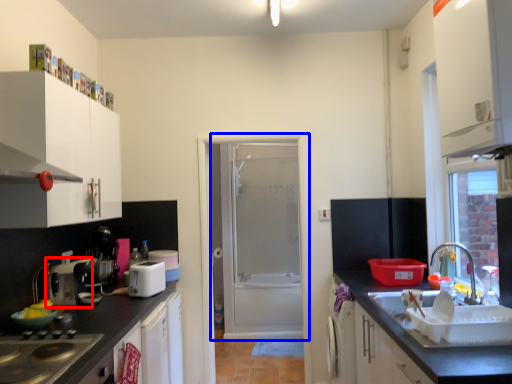
Question: Which object appears closest to the camera in this image, appliance (highlighted by a red box) or door (highlighted by a blue box)?

Choices:
 (A) appliance
 (B) door

Answer: (A)